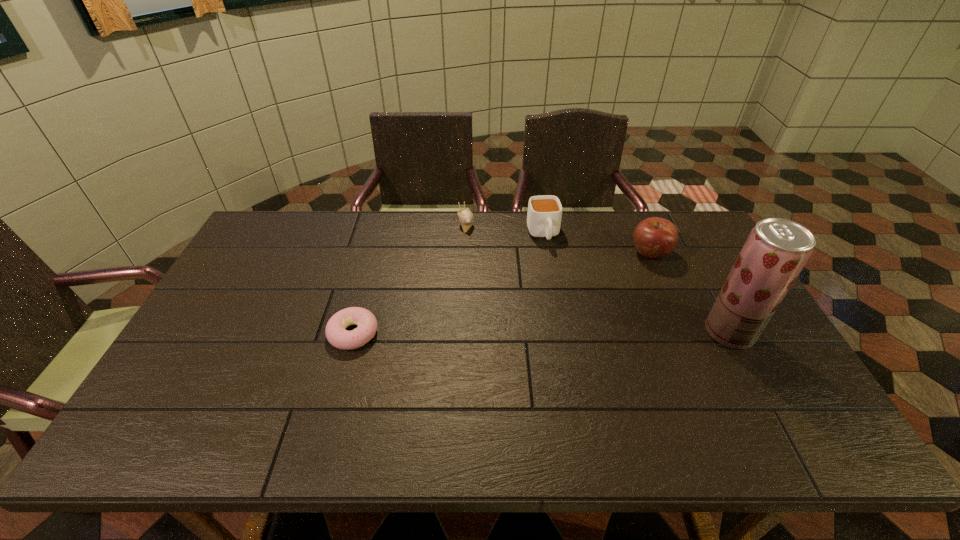
Where is `doughnut`? This screenshot has height=540, width=960. doughnut is located at coordinates (336, 334).

Locate an element on the screen. Image resolution: width=960 pixels, height=540 pixels. the shortest object is located at coordinates (336, 334).

Find the location of a particular element. Image resolution: width=960 pixels, height=540 pixels. fruit juice is located at coordinates (776, 250).

The image size is (960, 540). In order to click on the third object from right to left in this screenshot , I will do `click(544, 215)`.

Where is `apple`? apple is located at coordinates (654, 237).

This screenshot has width=960, height=540. Identify the location of the fourth tallest object. (466, 217).

At what (x,y) coordinates should I click in order to perform the action: click on escargot. Please return your answer as a coordinate pair (x, y). Looking at the image, I should click on (466, 217).

Where is `free location located on the left of the shortest object`? The width and height of the screenshot is (960, 540). free location located on the left of the shortest object is located at coordinates (224, 333).

Locate an element on the screen. free space located 0.270m on the left of the fruit juice is located at coordinates (609, 332).

Where is `vacant space located on the side with the handle of the cup`? This screenshot has height=540, width=960. vacant space located on the side with the handle of the cup is located at coordinates (563, 298).